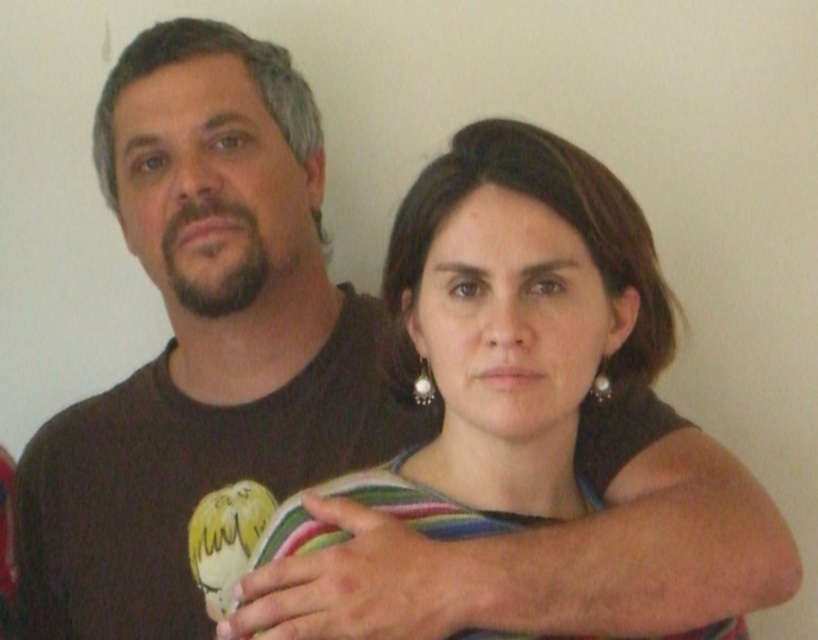
Question: Which object is farther from the camera taking this photo?

Choices:
 (A) multicolored striped shirt at center
 (B) dark brown t-shirt at center

Answer: (B)

Question: Which of the following is the farthest from the observer?

Choices:
 (A) (191, 61)
 (B) (551, 212)

Answer: (A)

Question: Is dark brown t-shirt at center above multicolored striped shirt at center?

Choices:
 (A) no
 (B) yes

Answer: (A)

Question: Where is dark brown t-shirt at center located in relation to multicolored striped shirt at center in the image?

Choices:
 (A) above
 (B) below

Answer: (B)

Question: Is dark brown t-shirt at center to the left of multicolored striped shirt at center from the viewer's perspective?

Choices:
 (A) yes
 (B) no

Answer: (A)